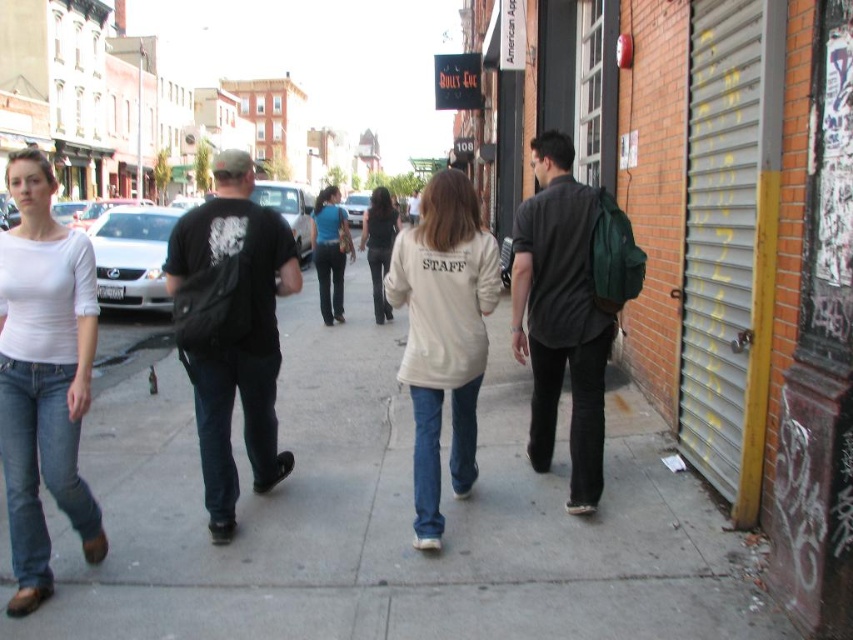
Question: Is gray concrete sidewalk at center to the left of matte white shirt at center from the viewer's perspective?

Choices:
 (A) no
 (B) yes

Answer: (A)

Question: Considering the real-world distances, which object is farthest from the beige cotton jacket at center?

Choices:
 (A) black matte backpack at center
 (B) dark gray shirt at right
 (C) dark gray jeans at center

Answer: (C)

Question: Can you confirm if dark gray shirt at right is positioned to the right of dark gray jeans at center?

Choices:
 (A) yes
 (B) no

Answer: (A)

Question: Estimate the real-world distances between objects in this image. Which object is farther from the beige cotton jacket at center?

Choices:
 (A) denim pants at center
 (B) dark gray jeans at center

Answer: (A)

Question: Observing the image, what is the correct spatial positioning of black matte backpack at center in reference to dark gray jeans at center?

Choices:
 (A) above
 (B) below

Answer: (B)

Question: Among these objects, which one is farthest from the camera?

Choices:
 (A) matte white shirt at center
 (B) denim pants at center
 (C) beige cotton jacket at center
 (D) dark gray shirt at right

Answer: (B)